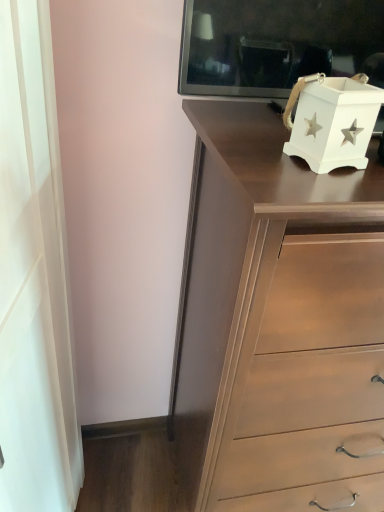
Question: Based on their sizes in the image, would you say white matte box at upper right is bigger or smaller than white matte curtain at left?

Choices:
 (A) big
 (B) small

Answer: (B)

Question: Is white matte box at upper right to the left or to the right of white matte curtain at left in the image?

Choices:
 (A) left
 (B) right

Answer: (B)

Question: Which object is positioned closest to the white matte curtain at left?

Choices:
 (A) white matte box at upper right
 (B) matte brown chest of drawers at center

Answer: (B)

Question: Which object is positioned closest to the matte brown chest of drawers at center?

Choices:
 (A) white matte curtain at left
 (B) white matte box at upper right

Answer: (B)